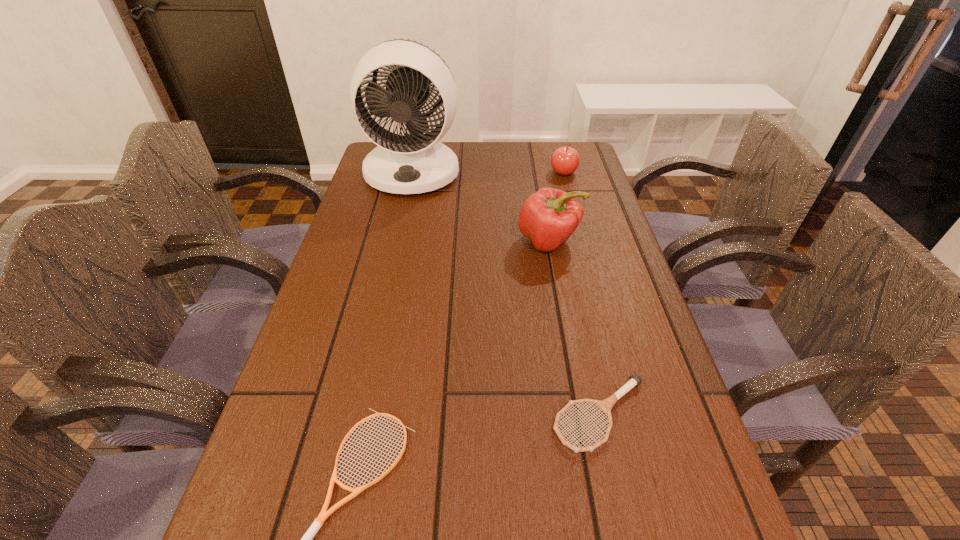
This screenshot has width=960, height=540. I want to click on free space at the right edge of the desktop, so click(x=625, y=281).

Locate an element on the screen. This screenshot has height=540, width=960. vacant region at the far right corner of the desktop is located at coordinates (540, 148).

Image resolution: width=960 pixels, height=540 pixels. I want to click on free spot between the fan and the third farthest object, so click(481, 207).

At what (x,y) coordinates should I click in order to perform the action: click on vacant space that is in between the taller tennis racket and the tallest object. Please return your answer as a coordinate pair (x, y). The width and height of the screenshot is (960, 540). Looking at the image, I should click on (506, 294).

Where is `unoccupied area between the fourth tallest object and the third nearest object`? unoccupied area between the fourth tallest object and the third nearest object is located at coordinates (575, 328).

Where is `free spot between the third shortest object and the taller tennis racket`? The width and height of the screenshot is (960, 540). free spot between the third shortest object and the taller tennis racket is located at coordinates (582, 294).

Find the location of `object that is the closest to the shorter tennis racket`. object that is the closest to the shorter tennis racket is located at coordinates (605, 405).

Locate which object ranks fourth in proximity to the third farthest object. Please provide its 2D coordinates. Your answer should be formatted as a tuple, i.e. [(x, y)], where the tuple contains the x and y coordinates of a point satisfying the conditions above.

[(324, 514)]

I want to click on free space that satisfies the following two spatial constraints: 1. on the grille of the right tennis racket; 2. on the right side of the tallest object, so click(x=360, y=415).

Identify the location of vacant region that satisfies the following two spatial constraints: 1. on the back side of the right tennis racket; 2. on the left side of the apple. (547, 172).